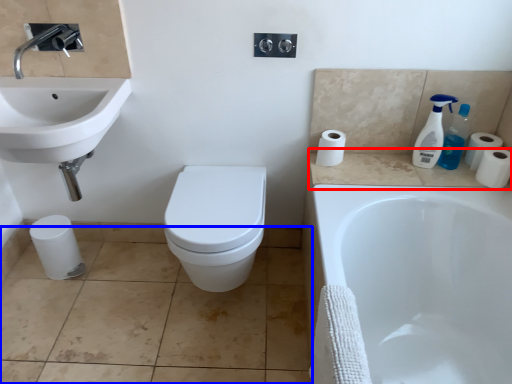
Question: Which object appears farthest to the camera in this image, counter top (highlighted by a red box) or tile (highlighted by a blue box)?

Choices:
 (A) counter top
 (B) tile

Answer: (A)